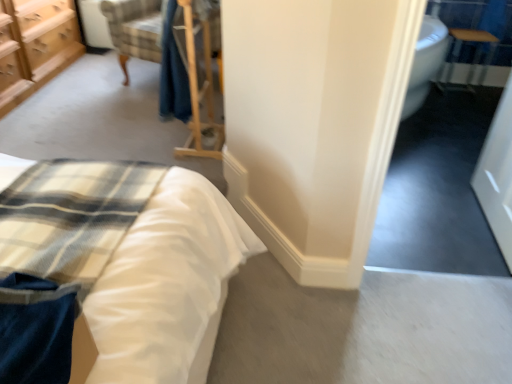
The height and width of the screenshot is (384, 512). I want to click on vacant area situated below white glossy door at right (from a real-world perspective), so click(x=485, y=225).